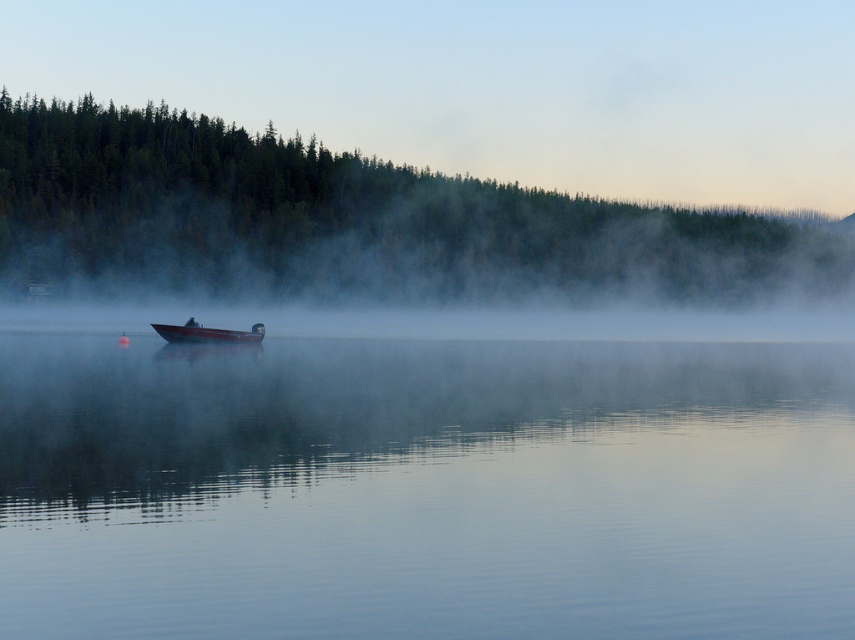
You are a fisherman standing on the shore of the lake. You see the clear water at center and the metallic red boat at center. How far apart are these two objects from each other?

The clear water at center and the metallic red boat at center are 13.33 meters apart from each other.

You are an observer standing on the lakeshore. You see the clear water at center and the metallic red boat at center. Which object takes up more space in the image?

The clear water at center takes up more space in the image than the metallic red boat at center because it is bigger according to the description.